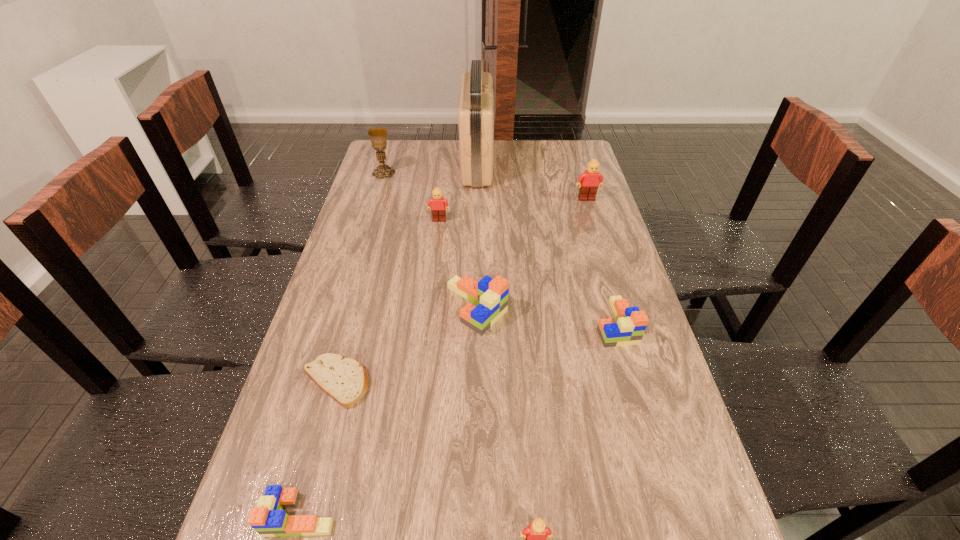
Locate an element on the screen. The width and height of the screenshot is (960, 540). vacant space located 0.120m on the back of the third nearest object is located at coordinates (353, 319).

Find the location of `radio receiver at the far edge`. radio receiver at the far edge is located at coordinates (475, 115).

Identify the location of chalice located at the far edge. (378, 136).

Find the location of a particular element. This screenshot has width=960, height=540. chalice that is positioned at the left edge is located at coordinates (378, 136).

Identify the location of Lego located at the left edge. This screenshot has width=960, height=540. (268, 519).

Locate an element on the screen. The height and width of the screenshot is (540, 960). pita bread at the left edge is located at coordinates (345, 380).

This screenshot has height=540, width=960. I want to click on object located at the far left corner, so click(x=378, y=136).

This screenshot has width=960, height=540. I want to click on free space at the far edge of the desktop, so click(x=447, y=151).

In the image, there is a desktop. At what (x,y) coordinates should I click in order to perform the action: click on vacant region at the left edge. Please return your answer as a coordinate pair (x, y). This screenshot has width=960, height=540. Looking at the image, I should click on (396, 221).

Image resolution: width=960 pixels, height=540 pixels. I want to click on free space at the right edge, so click(x=591, y=214).